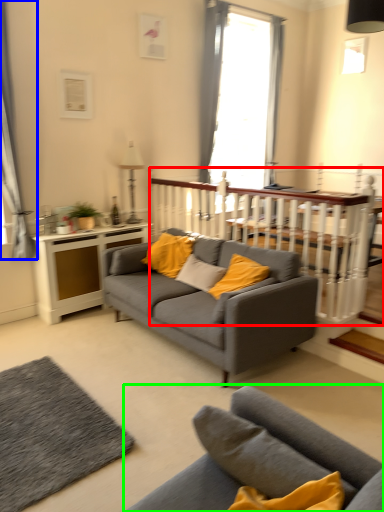
Question: Which object is the closest to the balustrade (highlighted by a red box)? Choose among these: curtain (highlighted by a blue box) or studio couch (highlighted by a green box).

Choices:
 (A) curtain
 (B) studio couch

Answer: (A)